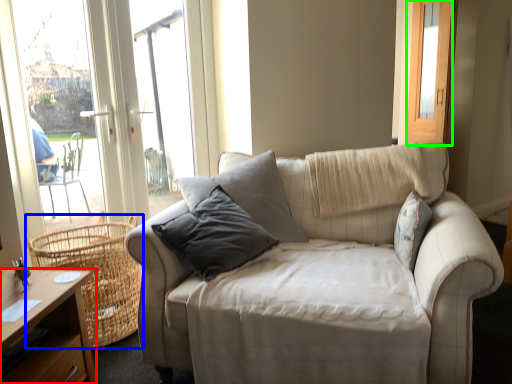
Question: Estimate the real-world distances between objects in this image. Which object is closer to desk (highlighted by a red box), basket (highlighted by a blue box) or screen door (highlighted by a green box)?

Choices:
 (A) basket
 (B) screen door

Answer: (A)